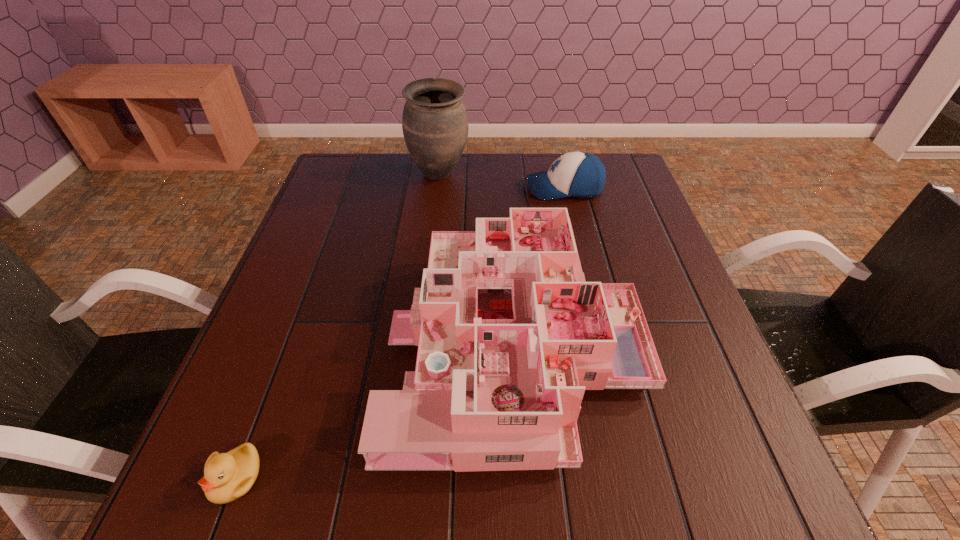
Identify which object is the third closest to the dollhouse. Please provide its 2D coordinates. Your answer should be formatted as a tuple, i.e. [(x, y)], where the tuple contains the x and y coordinates of a point satisfying the conditions above.

[(435, 127)]

I want to click on vacant region that satisfies the following two spatial constraints: 1. on the front-facing side of the second shortest object; 2. on the beak of the duckling, so click(x=634, y=477).

Where is `free region that satisfies the following two spatial constraints: 1. on the front-facing side of the second shortest object; 2. on the beak of the leftmost object`? This screenshot has height=540, width=960. free region that satisfies the following two spatial constraints: 1. on the front-facing side of the second shortest object; 2. on the beak of the leftmost object is located at coordinates (634, 477).

Where is `vacant region that satisfies the following two spatial constraints: 1. at the front entrance of the dollhouse; 2. on the beak of the duckling`? vacant region that satisfies the following two spatial constraints: 1. at the front entrance of the dollhouse; 2. on the beak of the duckling is located at coordinates (526, 477).